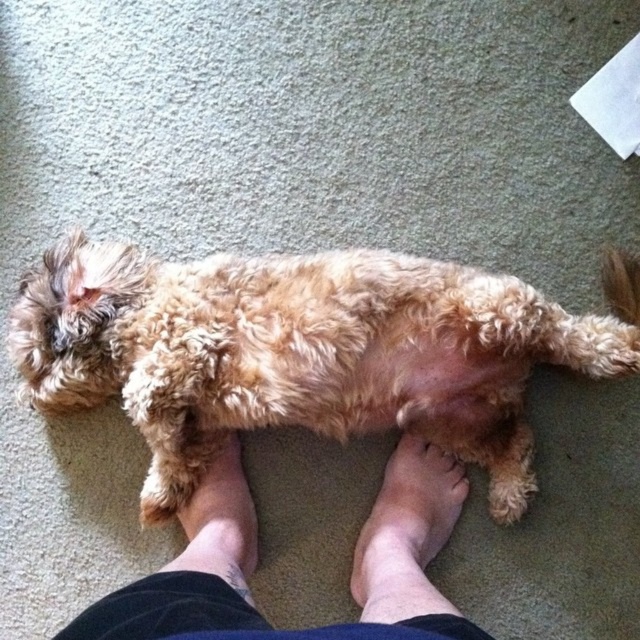
Can you confirm if light brown skin at center is thinner than brown furry foot at center?

No, light brown skin at center is not thinner than brown furry foot at center.

The height and width of the screenshot is (640, 640). I want to click on light brown skin at center, so click(406, 532).

The image size is (640, 640). Find the location of `barefoot feet at center`. barefoot feet at center is located at coordinates (257, 560).

The width and height of the screenshot is (640, 640). What do you see at coordinates (257, 560) in the screenshot?
I see `barefoot feet at center` at bounding box center [257, 560].

This screenshot has height=640, width=640. I want to click on barefoot feet at center, so click(x=257, y=560).

What are the coordinates of `barefoot feet at center` in the screenshot? It's located at (257, 560).

Who is more distant from viewer, (490,372) or (186,561)?

Positioned behind is point (490,372).

The width and height of the screenshot is (640, 640). What do you see at coordinates (307, 352) in the screenshot?
I see `fuzzy golden dog at center` at bounding box center [307, 352].

In order to click on fuzzy golden dog at center in this screenshot , I will do `click(307, 352)`.